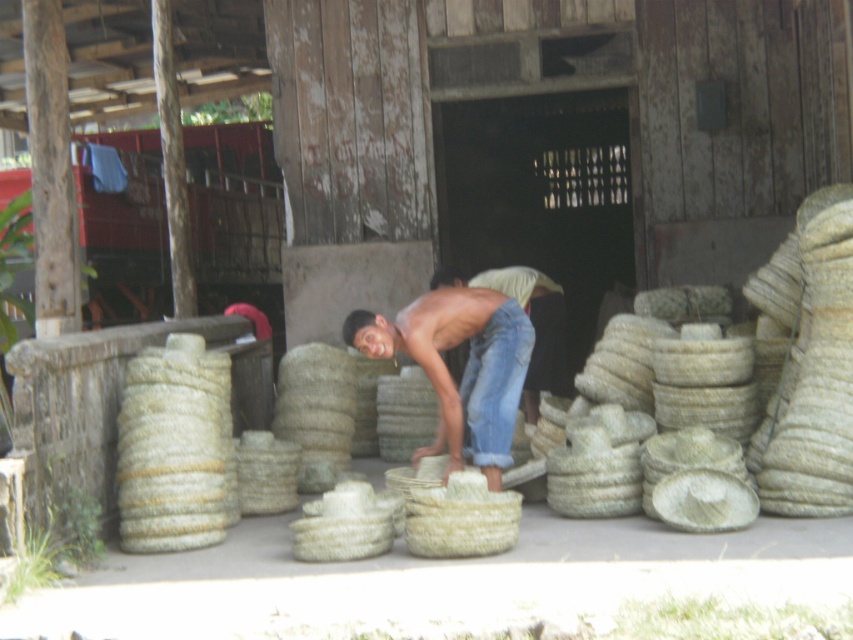
Based on the photo, is natural fiber rope at left further to camera compared to matte straw basket at center?

No, it is not.

This screenshot has height=640, width=853. I want to click on natural fiber rope at left, so click(175, 449).

Is matte straw basket at center shorter than jeans at center?

Incorrect, matte straw basket at center's height does not fall short of jeans at center's.

Can you confirm if matte straw basket at center is thinner than jeans at center?

In fact, matte straw basket at center might be wider than jeans at center.

This screenshot has height=640, width=853. What do you see at coordinates (463, 368) in the screenshot?
I see `matte straw basket at center` at bounding box center [463, 368].

The height and width of the screenshot is (640, 853). In order to click on matte straw basket at center in this screenshot , I will do `click(463, 368)`.

Who is more distant from viewer, (122, 492) or (505, 314)?

The point (505, 314) is more distant.

What do you see at coordinates (175, 449) in the screenshot?
I see `natural fiber rope at left` at bounding box center [175, 449].

Locate an element on the screen. Image resolution: width=853 pixels, height=640 pixels. natural fiber rope at left is located at coordinates (175, 449).